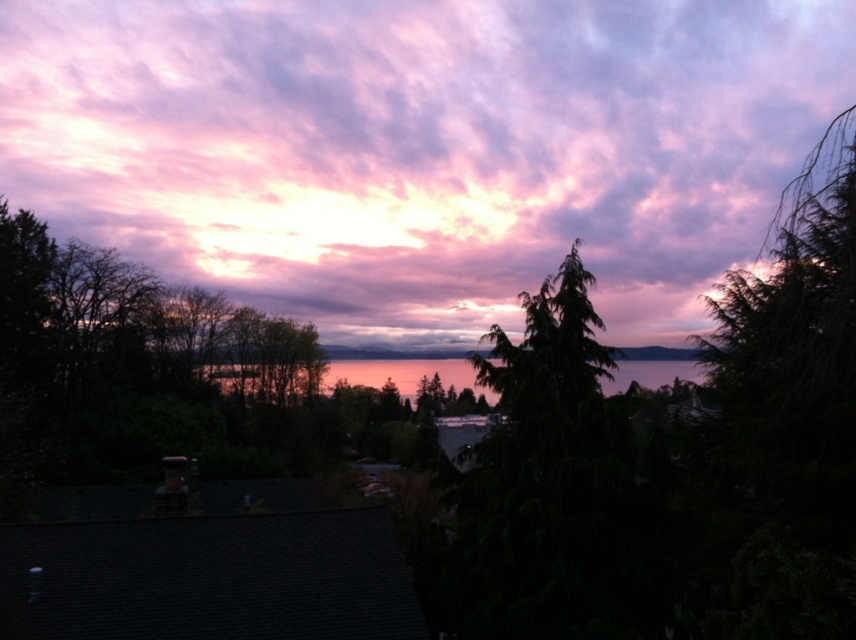
Question: Among these points, which one is nearest to the camera?

Choices:
 (A) (516, 458)
 (B) (116, 136)

Answer: (A)

Question: Is pink fluffy cloud at upper center further to the viewer compared to green matte tree at center?

Choices:
 (A) no
 (B) yes

Answer: (B)

Question: Does pink fluffy cloud at upper center have a greater width compared to green matte tree at center?

Choices:
 (A) no
 (B) yes

Answer: (B)

Question: Which point is farther to the camera?

Choices:
 (A) (525, 376)
 (B) (800, 33)

Answer: (B)

Question: Considering the relative positions of pink fluffy cloud at upper center and green matte tree at center in the image provided, where is pink fluffy cloud at upper center located with respect to green matte tree at center?

Choices:
 (A) above
 (B) below

Answer: (A)